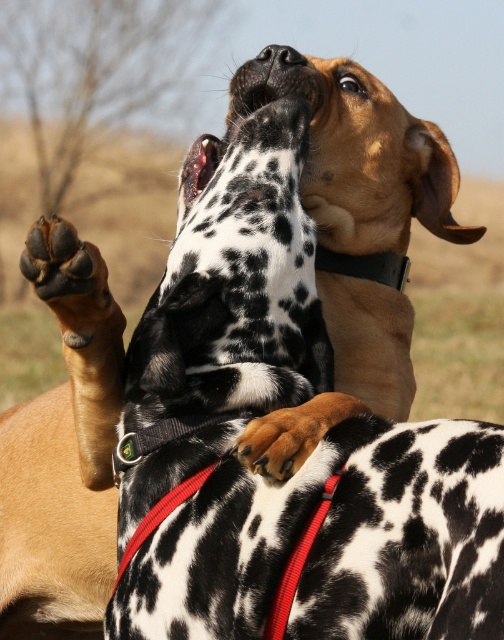
Question: Is the position of black rubber collar at upper center less distant than that of black smooth nose at upper center?

Choices:
 (A) yes
 (B) no

Answer: (B)

Question: Which is nearer to the brown fur paw at center?

Choices:
 (A) black smooth nose at upper center
 (B) black rubber collar at upper center

Answer: (B)

Question: Which point is farther from the camera taking this photo?

Choices:
 (A) (280, 54)
 (B) (297, 413)

Answer: (A)

Question: Is brown fur paw at center positioned at the back of black smooth nose at upper center?

Choices:
 (A) yes
 (B) no

Answer: (B)

Question: Does black rubber collar at upper center appear over black smooth nose at upper center?

Choices:
 (A) no
 (B) yes

Answer: (A)

Question: Based on their relative distances, which object is farther from the black smooth nose at upper center?

Choices:
 (A) brown fur paw at center
 (B) black rubber collar at upper center

Answer: (A)